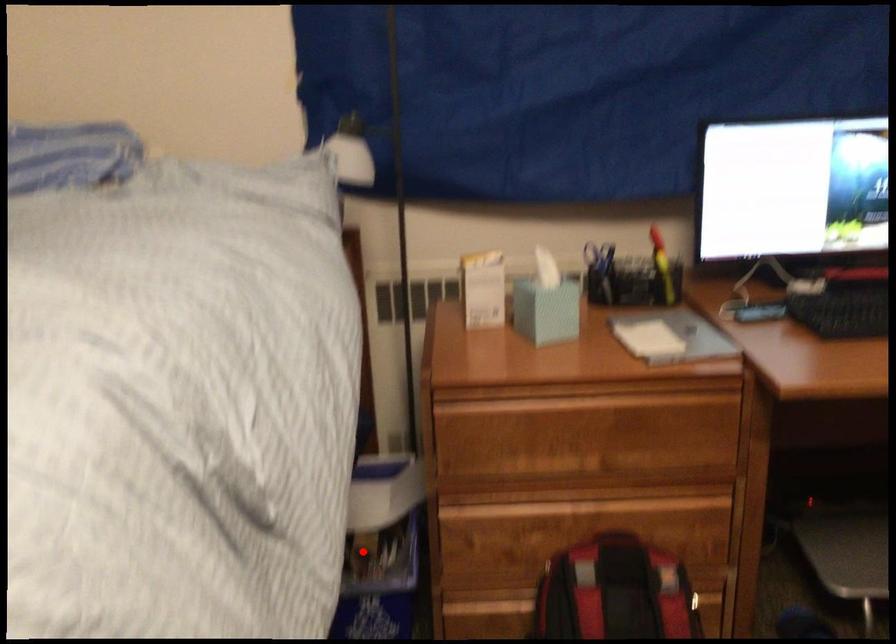
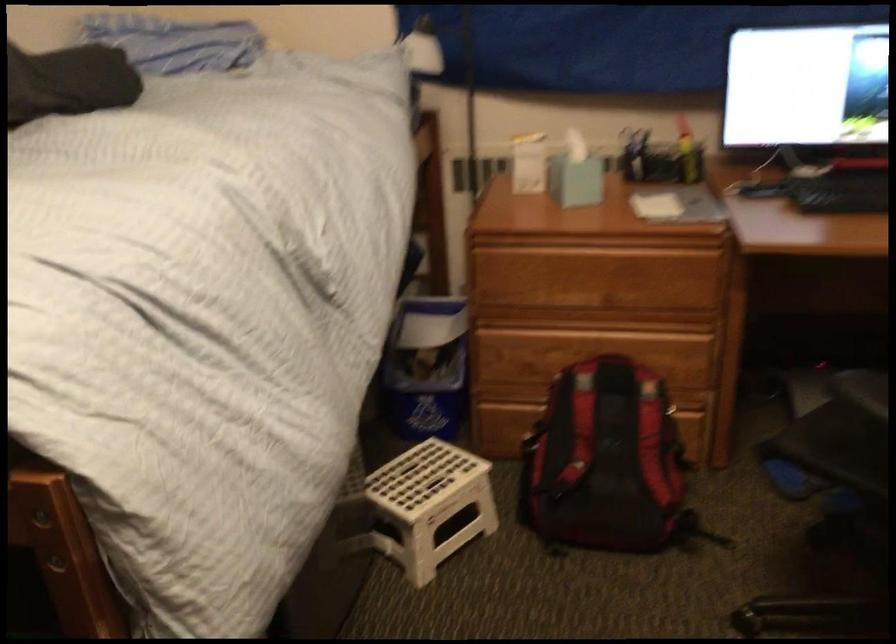
Where in the second image is the point corresponding to the highlighted location from the first image?

(426, 368)